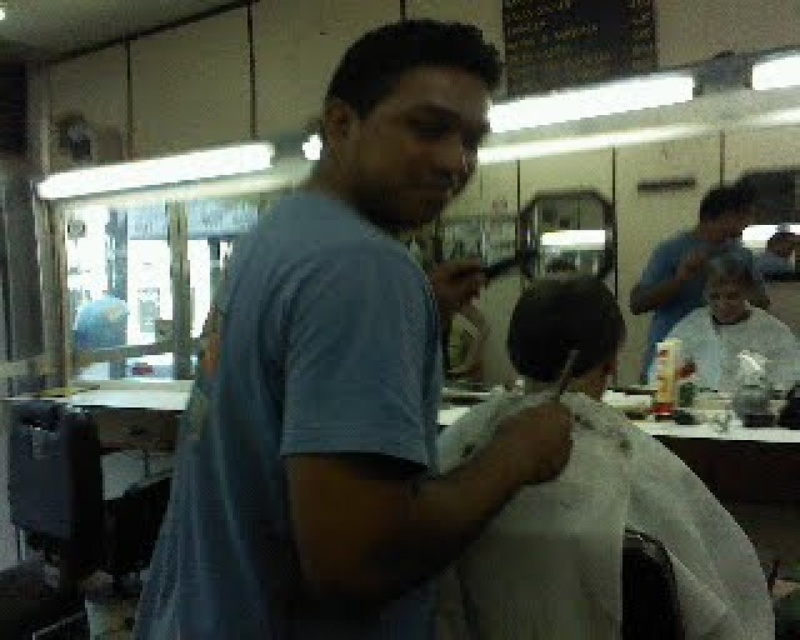
Question: Which point is farther to the camera?

Choices:
 (A) dark brown hair at center
 (B) matte blue shirt at upper right

Answer: (B)

Question: Which object is the closest to the dark brown hair at upper center?

Choices:
 (A) white cloth at center
 (B) matte black hair at upper center
 (C) blackboard at upper center

Answer: (C)

Question: Observing the image, what is the correct spatial positioning of dark brown hair at center in reference to matte black hair at upper center?

Choices:
 (A) right
 (B) left

Answer: (B)

Question: Which point is closer to the camera taking this photo?

Choices:
 (A) pos(790,340)
 (B) pos(722,184)
 (C) pos(745,260)
 (D) pos(524,328)

Answer: (D)

Question: Does matte blue shirt at upper right have a lesser width compared to dark brown hair at center?

Choices:
 (A) yes
 (B) no

Answer: (B)

Question: Does blackboard at upper center appear over matte blue shirt at upper right?

Choices:
 (A) yes
 (B) no

Answer: (A)